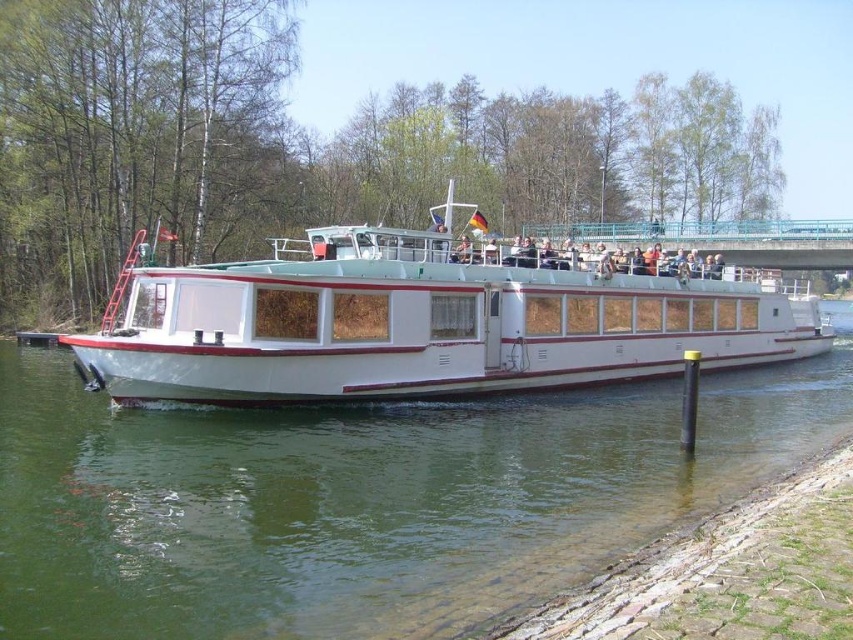
Can you confirm if white glossy boat at center is thinner than blue metallic bridge at upper center?

Incorrect, white glossy boat at center's width is not less than blue metallic bridge at upper center's.

Locate an element on the screen. white glossy boat at center is located at coordinates 422,321.

The height and width of the screenshot is (640, 853). Identify the location of green water at lower left. (361, 499).

Based on the photo, who is more distant from viewer, (x=540, y=406) or (x=672, y=228)?

The point (x=672, y=228) is more distant.

Where is `green water at lower left`? The image size is (853, 640). green water at lower left is located at coordinates (361, 499).

At what (x,y) coordinates should I click in order to perform the action: click on green water at lower left. Please return your answer as a coordinate pair (x, y). Looking at the image, I should click on click(361, 499).

Which is below, green water at lower left or white glossy boat at center?

Positioned lower is green water at lower left.

Does point (426, 497) come in front of point (709, 280)?

That is True.

Locate an element on the screen. This screenshot has width=853, height=640. green water at lower left is located at coordinates (361, 499).